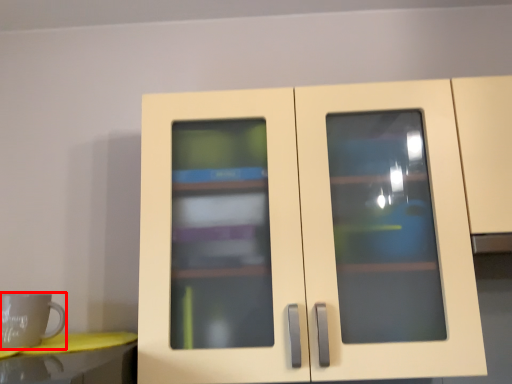
Question: Where is mug (annotated by the red box) located in relation to cupboard in the image?

Choices:
 (A) right
 (B) left

Answer: (B)